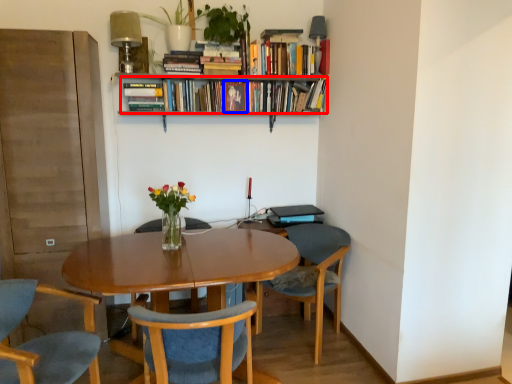
Question: Among these objects, which one is farthest to the camera, book (highlighted by a red box) or book (highlighted by a blue box)?

Choices:
 (A) book
 (B) book

Answer: (B)